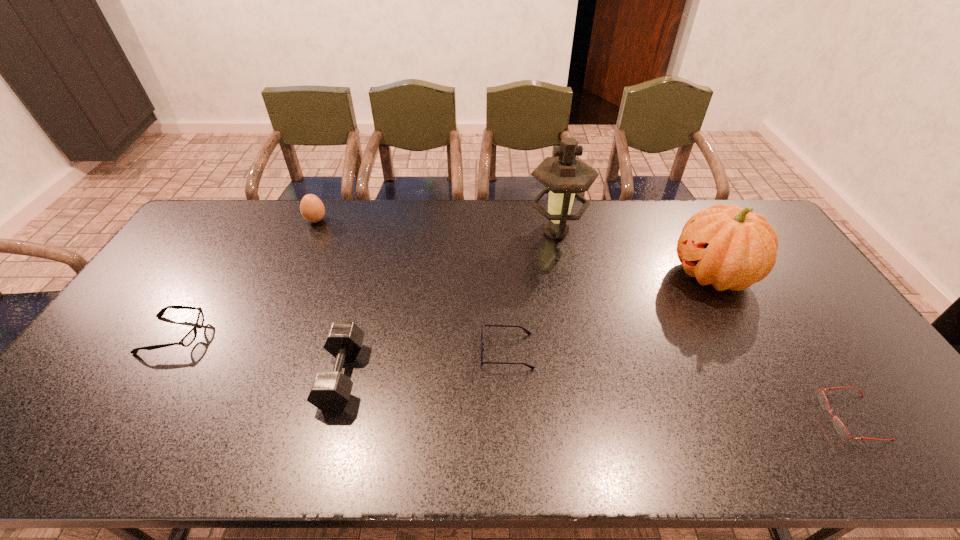
Where is `object that is at the near right corner`? object that is at the near right corner is located at coordinates (838, 425).

Locate an element on the screen. This screenshot has height=540, width=960. vacant point at the far edge is located at coordinates (289, 215).

The width and height of the screenshot is (960, 540). In order to click on free space at the near edge of the desktop in this screenshot , I will do `click(459, 428)`.

Where is `vacant space at the left edge of the desktop`? Image resolution: width=960 pixels, height=540 pixels. vacant space at the left edge of the desktop is located at coordinates (162, 268).

At what (x,y) coordinates should I click in order to perform the action: click on blank area at the right edge. Please return your answer as a coordinate pair (x, y). The image size is (960, 540). Looking at the image, I should click on (779, 310).

This screenshot has width=960, height=540. I want to click on free point between the fourth object from left to right and the sixth shortest object, so click(x=610, y=313).

Where is `unoccupied position between the fifth shortest object and the dumbbell`? The image size is (960, 540). unoccupied position between the fifth shortest object and the dumbbell is located at coordinates (329, 298).

This screenshot has width=960, height=540. Find the location of `empty space that is in between the second spectacles from left to right and the second object from left to right`. empty space that is in between the second spectacles from left to right and the second object from left to right is located at coordinates (412, 286).

I want to click on free space between the second object from left to right and the third object from right to left, so click(x=436, y=226).

Identify the location of free spot between the fifth object from left to right and the fourth tallest object. (449, 303).